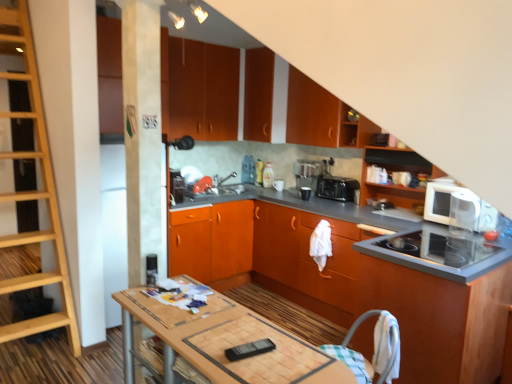
Locate an element on the screen. This screenshot has height=384, width=512. matte orange cabinet at upper center, which appears as the fifth cabinetry when ordered from the bottom is located at coordinates (314, 113).

Describe the element at coordinates (314, 113) in the screenshot. I see `matte orange cabinet at upper center, which ranks as the third cabinetry in top-to-bottom order` at that location.

What is the approximate height of matte orange cabinet at upper center, which is counted as the fourth cabinetry, starting from the top?

40.13 centimeters.

This screenshot has height=384, width=512. What do you see at coordinates (177, 187) in the screenshot?
I see `metallic silver toaster at center, arranged as the 1th appliance when viewed from the left` at bounding box center [177, 187].

Locate an element on the screen. Image resolution: width=512 pixels, height=384 pixels. metallic silver toaster at center, acting as the first appliance starting from the top is located at coordinates (177, 187).

In order to face wooden ladder at left, should I rotate leftwards or rightwards?

Rotate left and turn 29.809 degrees.

I want to click on matte orange cabinet at upper center, which appears as the fifth cabinetry when ordered from the bottom, so click(x=314, y=113).

From the image's perspective, between metallic silver toaster at center, which is the 1th appliance from back to front, and wooden ladder at left, who is located below?

metallic silver toaster at center, which is the 1th appliance from back to front.

Considering the relative positions of metallic silver toaster at center, arranged as the 1th appliance when viewed from the left, and wooden ladder at left in the image provided, is metallic silver toaster at center, arranged as the 1th appliance when viewed from the left, in front of wooden ladder at left?

No, metallic silver toaster at center, arranged as the 1th appliance when viewed from the left, is behind wooden ladder at left.

Based on the photo, what's the angular difference between metallic silver toaster at center, which is the 1th appliance from back to front, and wooden ladder at left's facing directions?

The facing directions of metallic silver toaster at center, which is the 1th appliance from back to front, and wooden ladder at left are 0.00053 degrees apart.

Considering the positions of point (176, 191) and point (0, 74), is point (176, 191) closer or farther from the camera than point (0, 74)?

Point (176, 191) is farther from the camera than point (0, 74).

Which object is positioned more to the left, orange wood cabinet at center, which is the 7th cabinetry from top to bottom, or matte orange cabinet at upper center, which is counted as the fourth cabinetry, starting from the top?

orange wood cabinet at center, which is the 7th cabinetry from top to bottom, is more to the left.

Between point (434, 285) and point (346, 134), which one is positioned behind?

The point (346, 134) is more distant.

Is orange wood cabinet at center, which is the first cabinetry from bottom to top, looking in the opposite direction of matte orange cabinet at upper center, which is counted as the fourth cabinetry, starting from the top?

No.

Looking at this image, how distant is orange wood cabinet at center, which is the first cabinetry from bottom to top, from matte orange cabinet at upper center, which is the 4th cabinetry in bottom-to-top order?

The distance of orange wood cabinet at center, which is the first cabinetry from bottom to top, from matte orange cabinet at upper center, which is the 4th cabinetry in bottom-to-top order, is 39.29 inches.

From the image's perspective, between orange matte cabinet at upper center, the second cabinetry in the top-to-bottom sequence, and black plastic toaster at center, which one is located above?

orange matte cabinet at upper center, the second cabinetry in the top-to-bottom sequence.

Between orange matte cabinet at upper center, the second cabinetry in the top-to-bottom sequence, and black plastic toaster at center, which one has larger width?

Wider between the two is orange matte cabinet at upper center, the second cabinetry in the top-to-bottom sequence.

How many degrees apart are the facing directions of orange matte cabinet at upper center, the 6th cabinetry from the bottom, and black plastic toaster at center?

The angular difference between orange matte cabinet at upper center, the 6th cabinetry from the bottom, and black plastic toaster at center is 90 degrees.

Considering the positions of points (231, 102) and (330, 180), is point (231, 102) farther from camera compared to point (330, 180)?

Yes, point (231, 102) is farther from viewer.

Is black plastic toaster at center placed right next to matte orange cabinet at upper center, the seventh cabinetry in the bottom-to-top sequence?

No, black plastic toaster at center is not touching matte orange cabinet at upper center, the seventh cabinetry in the bottom-to-top sequence.

From the image's perspective, which cabinetry is the 5th one above the black plastic toaster at center? Please provide its 2D coordinates.

[(265, 96)]

Can you confirm if black plastic toaster at center is taller than matte orange cabinet at upper center, the seventh cabinetry in the bottom-to-top sequence?

No, black plastic toaster at center is not taller than matte orange cabinet at upper center, the seventh cabinetry in the bottom-to-top sequence.

Is point (320, 191) farther from camera compared to point (269, 102)?

No, (320, 191) is closer to viewer.

Who is taller, black plastic remote at center, placed as the first appliance when sorted from bottom to top, or wooden table at center?

wooden table at center is taller.

In the scene shown: Could you measure the distance between black plastic remote at center, placed as the first appliance when sorted from bottom to top, and wooden table at center?

black plastic remote at center, placed as the first appliance when sorted from bottom to top, is 9.83 inches away from wooden table at center.

From the image's perspective, is black plastic remote at center, acting as the second appliance starting from the back, above or below wooden table at center?

Based on their image positions, black plastic remote at center, acting as the second appliance starting from the back, is located above wooden table at center.

Is wooden table at center located within black plastic remote at center, positioned as the 2th appliance in top-to-bottom order?

No.

Can you confirm if metallic silver toaster at center, the second appliance when ordered from right to left, is shorter than checkered fabric folding chair at lower right?

No, metallic silver toaster at center, the second appliance when ordered from right to left, is not shorter than checkered fabric folding chair at lower right.

Looking at their sizes, would you say metallic silver toaster at center, arranged as the 1th appliance when viewed from the left, is wider or thinner than checkered fabric folding chair at lower right?

In the image, metallic silver toaster at center, arranged as the 1th appliance when viewed from the left, appears to be more narrow than checkered fabric folding chair at lower right.

From the image's perspective, would you say metallic silver toaster at center, the second appliance when ordered from right to left, is positioned over checkered fabric folding chair at lower right?

Yes, from the image's perspective, metallic silver toaster at center, the second appliance when ordered from right to left, is above checkered fabric folding chair at lower right.

Is point (180, 181) positioned before point (396, 338)?

That is False.

Which is in front, point (354, 131) or point (393, 366)?

Point (393, 366)

Does matte orange cabinet at upper center, which is the 4th cabinetry in bottom-to-top order, lie in front of checkered fabric folding chair at lower right?

That is False.

What are the coordinates of `folding chair on the left of matte orange cabinet at upper center, which is the 4th cabinetry in bottom-to-top order` in the screenshot? It's located at (375, 349).

There is a wooden ladder at left. Where is `the 1st appliance below it (from the image's perspective)`? the 1st appliance below it (from the image's perspective) is located at coordinates (177, 187).

Locate an element on the screen. Image resolution: width=512 pixels, height=384 pixels. the 3rd cabinetry to the left of the matte orange cabinet at upper center, which is counted as the fourth cabinetry, starting from the top, starting your count from the anchor is located at coordinates (356, 280).

When comparing their distances from black plastic remote at center, which is the 2th appliance from left to right, does metallic silver toaster at center, acting as the first appliance starting from the top, or orange wood cabinet at center, which is the 7th cabinetry from top to bottom, seem further?

metallic silver toaster at center, acting as the first appliance starting from the top, is further to black plastic remote at center, which is the 2th appliance from left to right.

Looking at the image, which one is located further to matte orange cabinet at upper center, the seventh cabinetry in the bottom-to-top sequence, orange matte cabinet at center, which is counted as the sixth cabinetry, starting from the top, or matte orange cabinet at upper center, which ranks as the third cabinetry in top-to-bottom order?

orange matte cabinet at center, which is counted as the sixth cabinetry, starting from the top.

Based on the photo, from the image, which object appears to be farther from black plastic remote at center, which is the 1th appliance in front-to-back order, metallic silver toaster at center, acting as the first appliance starting from the top, or orange matte cabinet at center, which is counted as the sixth cabinetry, starting from the top?

The object further to black plastic remote at center, which is the 1th appliance in front-to-back order, is metallic silver toaster at center, acting as the first appliance starting from the top.

Which object lies nearer to the anchor point wooden table at center, matte orange cabinet at upper center, which is the 1th cabinetry in top-to-bottom order, or white glossy microwave at upper right?

Among the two, white glossy microwave at upper right is located nearer to wooden table at center.

Looking at the image, which one is located further to black plastic toaster at center, orange wood cabinet at center, which is the first cabinetry from bottom to top, or wooden table at center?

wooden table at center is further to black plastic toaster at center.

Based on their spatial positions, is orange matte cabinet at center, which is counted as the sixth cabinetry, starting from the top, or orange matte cabinet at upper right, acting as the 5th cabinetry starting from the top, further from orange wood cabinet at center, which is the 7th cabinetry from top to bottom?

orange matte cabinet at upper right, acting as the 5th cabinetry starting from the top, is further to orange wood cabinet at center, which is the 7th cabinetry from top to bottom.

From the image, which object appears to be farther from black plastic remote at center, acting as the second appliance starting from the back, wooden ladder at left or metallic silver toaster at center, acting as the first appliance starting from the top?

metallic silver toaster at center, acting as the first appliance starting from the top, is further to black plastic remote at center, acting as the second appliance starting from the back.

From the image, which object appears to be farther from wooden table at center, checkered fabric folding chair at lower right or orange matte cabinet at center, which ranks as the second cabinetry in bottom-to-top order?

The object further to wooden table at center is orange matte cabinet at center, which ranks as the second cabinetry in bottom-to-top order.

The width and height of the screenshot is (512, 384). I want to click on coffee machine between orange matte cabinet at upper center, the second cabinetry in the top-to-bottom sequence, and orange matte cabinet at upper right, positioned as the 3th cabinetry in bottom-to-top order, from left to right, so click(306, 174).

The image size is (512, 384). In order to click on folding chair situated between wooden ladder at left and orange matte cabinet at center, which ranks as the second cabinetry in bottom-to-top order, from left to right in this screenshot , I will do `click(375, 349)`.

Where is `home appliance between wooden table at center and orange matte cabinet at center, which ranks as the second cabinetry in bottom-to-top order, in the front-back direction`? The image size is (512, 384). home appliance between wooden table at center and orange matte cabinet at center, which ranks as the second cabinetry in bottom-to-top order, in the front-back direction is located at coordinates (443, 201).

Find the location of `folding chair positioned between black plastic remote at center, which is the 2th appliance from left to right, and orange matte cabinet at upper center, the second cabinetry in the top-to-bottom sequence, from near to far`. folding chair positioned between black plastic remote at center, which is the 2th appliance from left to right, and orange matte cabinet at upper center, the second cabinetry in the top-to-bottom sequence, from near to far is located at coordinates (375, 349).